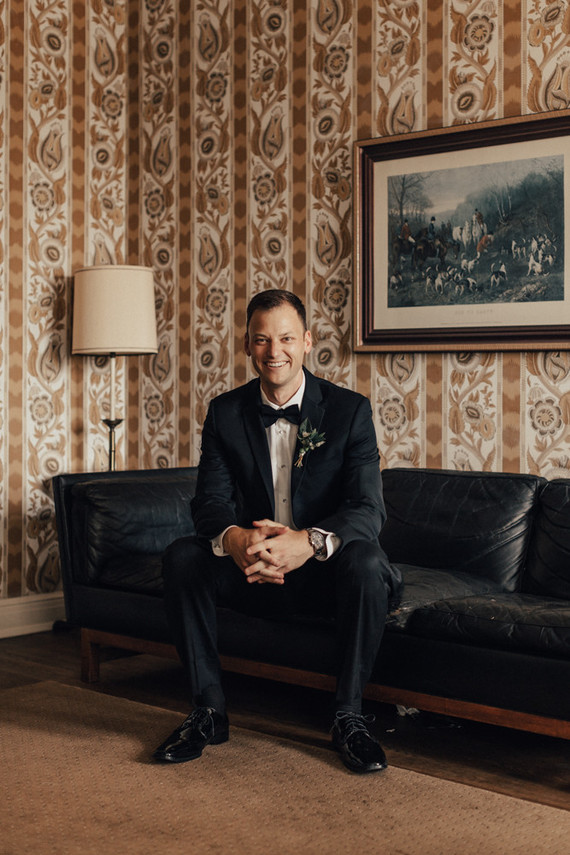
The image size is (570, 855). In order to click on lamp in this screenshot , I will do `click(128, 321)`.